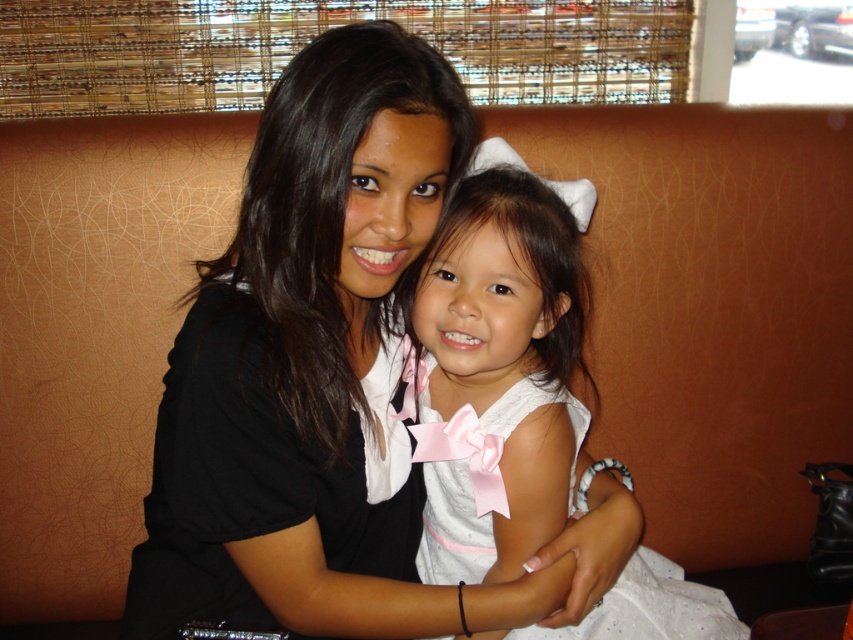
You are an interior designer assessing the seating arrangement in a restaurant booth. You notice the black matte shirt at center and the white satin dress at center. Which clothing item is closer to the front of the booth?

The black matte shirt at center is closer to the front of the booth because it is positioned in front of the white satin dress at center.

You are a photographer setting up for a portrait. You need to ensure that the black matte shirt at center and the white satin dress at center are both visible in the frame. Based on their positions, which one should you focus on first to ensure proper exposure?

The black matte shirt at center is above the white satin dress at center, so you should focus on the white satin dress at center first to ensure proper exposure since it is closer to the camera and might require more attention to capture its details accurately.

You are designing a seating arrangement for a photo shoot and need to place a black matte shirt at center and a white satin dress at center so that they are visible in the frame. Based on their heights, which one should you position closer to the front to ensure both are visible?

The black matte shirt at center is much taller than the white satin dress at center, so to ensure both are visible in the frame, position the white satin dress at center closer to the front.